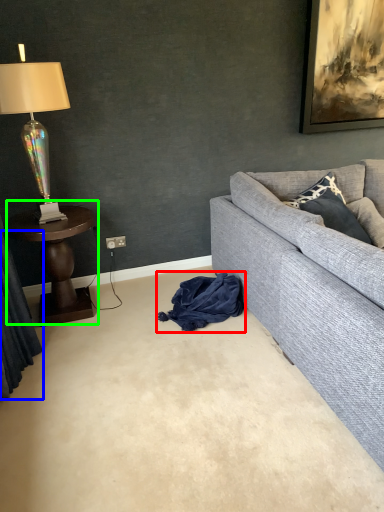
Question: Which is nearer to the material (highlighted by a red box)? curtain (highlighted by a blue box) or table (highlighted by a green box).

Choices:
 (A) curtain
 (B) table

Answer: (B)